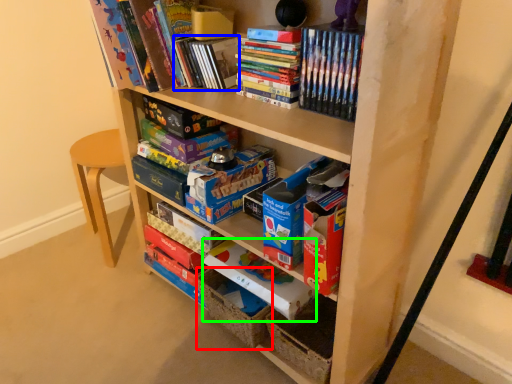
Question: Estimate the real-world distances between objects in this image. Which object is farther from storage box (highlighted by a red box), paperback book (highlighted by a blue box) or paperback book (highlighted by a green box)?

Choices:
 (A) paperback book
 (B) paperback book

Answer: (A)